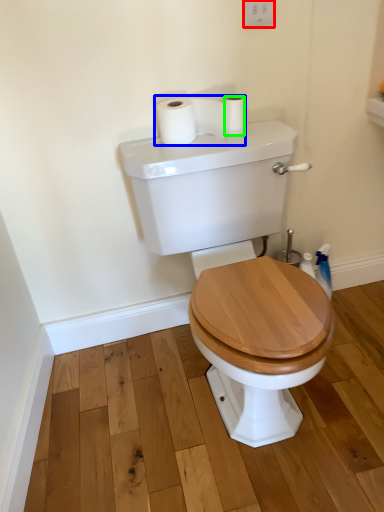
Question: Which object is positioned farthest from electric outlet (highlighted by a red box)? Select from toilet paper (highlighted by a blue box) and toilet paper (highlighted by a green box).

Choices:
 (A) toilet paper
 (B) toilet paper

Answer: (A)